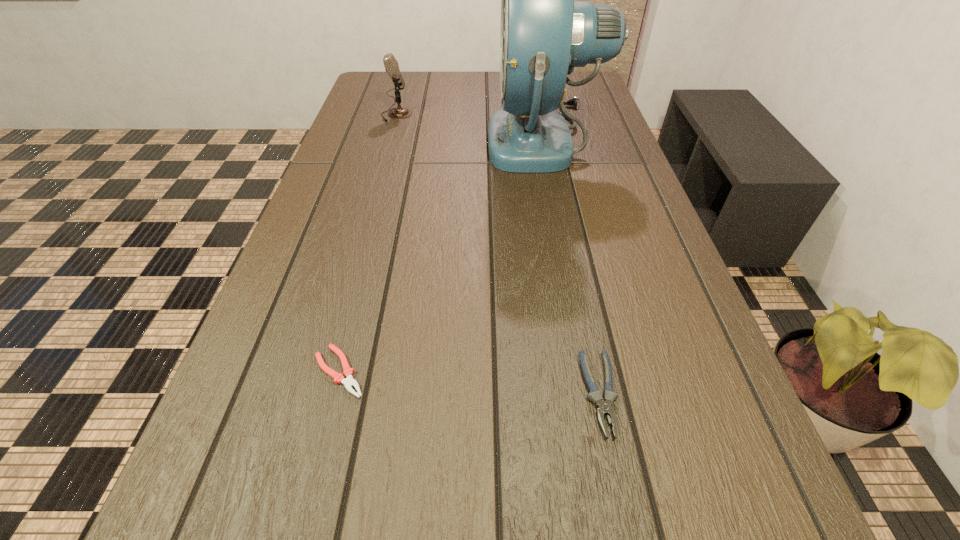
Locate an element on the screen. free point between the third shortest object and the right pliers is located at coordinates (498, 254).

Find the location of a particular element. The height and width of the screenshot is (540, 960). empty location between the taller pliers and the fan is located at coordinates (572, 267).

Locate an element on the screen. The width and height of the screenshot is (960, 540). vacant area between the taller pliers and the microphone is located at coordinates (498, 254).

At what (x,y) coordinates should I click in order to perform the action: click on blank region between the third tallest object and the microphone. Please return your answer as a coordinate pair (x, y). Looking at the image, I should click on (498, 254).

Locate an element on the screen. Image resolution: width=960 pixels, height=540 pixels. free spot between the left pliers and the microphone is located at coordinates (368, 243).

This screenshot has height=540, width=960. What are the coordinates of `free space between the taller pliers and the shortest object` in the screenshot? It's located at (469, 383).

The height and width of the screenshot is (540, 960). In order to click on vacant area that lies between the fan and the left pliers in this screenshot , I will do `click(443, 255)`.

Where is `vacant region between the shorter pliers and the tallest object`? vacant region between the shorter pliers and the tallest object is located at coordinates (443, 255).

Locate an element on the screen. unoccupied area between the fan and the left pliers is located at coordinates (443, 255).

Find the location of `object that is the second closest to the fan`. object that is the second closest to the fan is located at coordinates (604, 407).